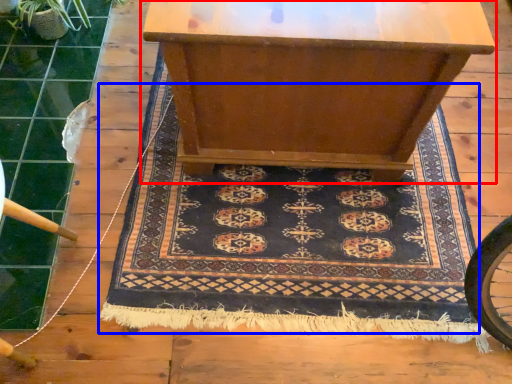
Question: Among these objects, which one is farthest to the camera, table (highlighted by a red box) or mat (highlighted by a blue box)?

Choices:
 (A) table
 (B) mat

Answer: (B)